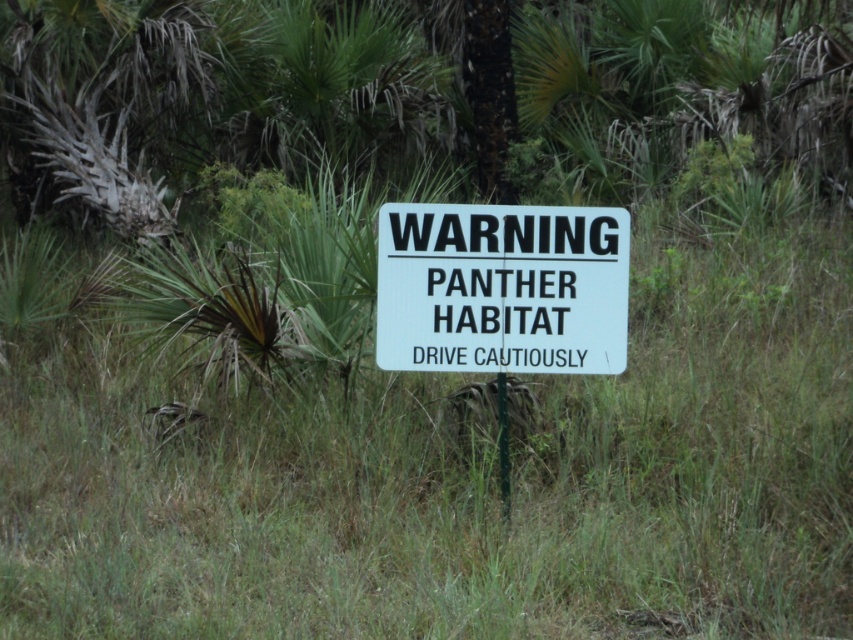
Question: Among these objects, which one is farthest from the camera?

Choices:
 (A) white plastic sign at center
 (B) green leafy tree at center

Answer: (B)

Question: Which of the following is the farthest from the observer?

Choices:
 (A) green leafy tree at center
 (B) white plastic sign at center

Answer: (A)

Question: Is green leafy tree at center to the left of white plastic sign at center from the viewer's perspective?

Choices:
 (A) no
 (B) yes

Answer: (B)

Question: Is green leafy tree at center closer to the viewer compared to white plastic sign at center?

Choices:
 (A) yes
 (B) no

Answer: (B)

Question: Can you confirm if green leafy tree at center is positioned to the right of white plastic sign at center?

Choices:
 (A) yes
 (B) no

Answer: (B)